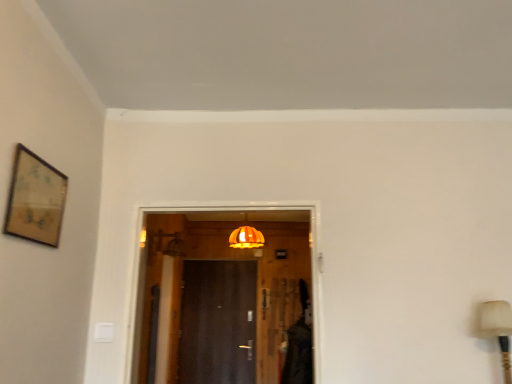
Question: Does wooden framed artwork at upper left have a lesser height compared to orange fabric lampshade at center?

Choices:
 (A) no
 (B) yes

Answer: (B)

Question: Considering the relative sizes of wooden framed artwork at upper left and orange fabric lampshade at center in the image provided, is wooden framed artwork at upper left bigger than orange fabric lampshade at center?

Choices:
 (A) no
 (B) yes

Answer: (A)

Question: Are wooden framed artwork at upper left and orange fabric lampshade at center far apart?

Choices:
 (A) yes
 (B) no

Answer: (A)

Question: Are wooden framed artwork at upper left and orange fabric lampshade at center beside each other?

Choices:
 (A) yes
 (B) no

Answer: (B)

Question: From the image's perspective, is wooden framed artwork at upper left under orange fabric lampshade at center?

Choices:
 (A) no
 (B) yes

Answer: (A)

Question: Is point (49, 241) closer or farther from the camera than point (487, 301)?

Choices:
 (A) farther
 (B) closer

Answer: (B)

Question: Relative to matte beige table lamp at right, is wooden framed artwork at upper left in front or behind?

Choices:
 (A) behind
 (B) front

Answer: (B)

Question: From a real-world perspective, is wooden framed artwork at upper left above or below matte beige table lamp at right?

Choices:
 (A) above
 (B) below

Answer: (A)

Question: Considering the positions of wooden framed artwork at upper left and matte beige table lamp at right in the image, is wooden framed artwork at upper left bigger or smaller than matte beige table lamp at right?

Choices:
 (A) small
 (B) big

Answer: (A)

Question: From their relative heights in the image, would you say orange fabric lampshade at center is taller or shorter than matte beige table lamp at right?

Choices:
 (A) tall
 (B) short

Answer: (B)

Question: Considering their positions, is orange fabric lampshade at center located in front of or behind matte beige table lamp at right?

Choices:
 (A) behind
 (B) front

Answer: (A)

Question: Considering the positions of orange fabric lampshade at center and matte beige table lamp at right in the image, is orange fabric lampshade at center bigger or smaller than matte beige table lamp at right?

Choices:
 (A) big
 (B) small

Answer: (A)

Question: Choose the correct answer: Is orange fabric lampshade at center inside matte beige table lamp at right or outside it?

Choices:
 (A) inside
 (B) outside

Answer: (B)

Question: Does point (506, 364) appear closer or farther from the camera than point (32, 196)?

Choices:
 (A) closer
 (B) farther

Answer: (B)

Question: Is matte beige table lamp at right situated inside wooden framed artwork at upper left or outside?

Choices:
 (A) inside
 (B) outside

Answer: (B)